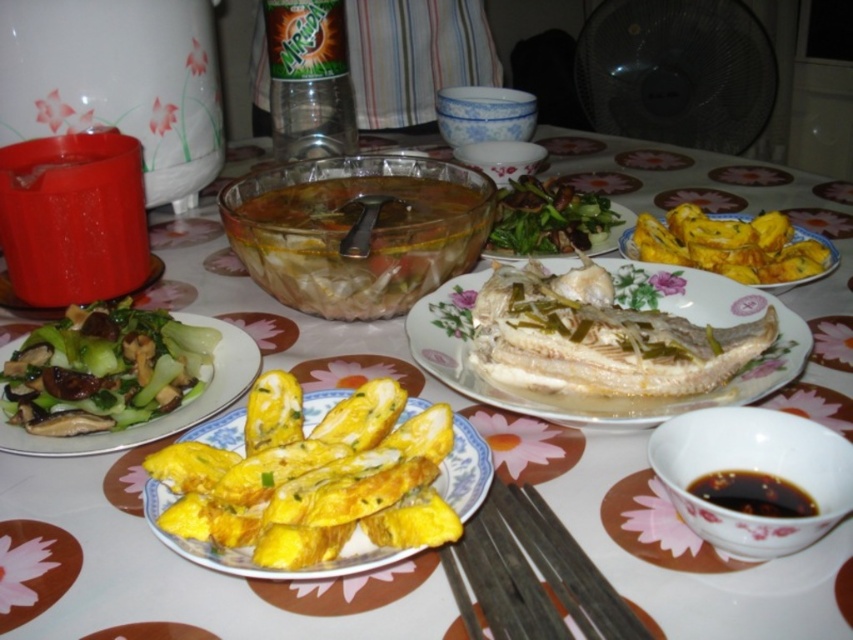
Can you confirm if yellow fried egg at center is positioned to the right of green leafy vegetables with mushrooms at left?

Indeed, yellow fried egg at center is positioned on the right side of green leafy vegetables with mushrooms at left.

Where is `yellow fried egg at center`? yellow fried egg at center is located at coordinates (314, 477).

Who is positioned more to the right, white glossy fish at center or yellow fried pastry at center?

yellow fried pastry at center is more to the right.

Is white glossy fish at center further to camera compared to yellow fried pastry at center?

That is False.

This screenshot has width=853, height=640. I want to click on white glossy fish at center, so click(x=601, y=337).

Does yellow fried pastry at center come in front of green leafy vegetables at center?

Yes.

Which is above, yellow fried pastry at center or green leafy vegetables at center?

green leafy vegetables at center is higher up.

What do you see at coordinates (730, 244) in the screenshot? This screenshot has height=640, width=853. I see `yellow fried pastry at center` at bounding box center [730, 244].

This screenshot has height=640, width=853. In order to click on yellow fried pastry at center in this screenshot , I will do `click(730, 244)`.